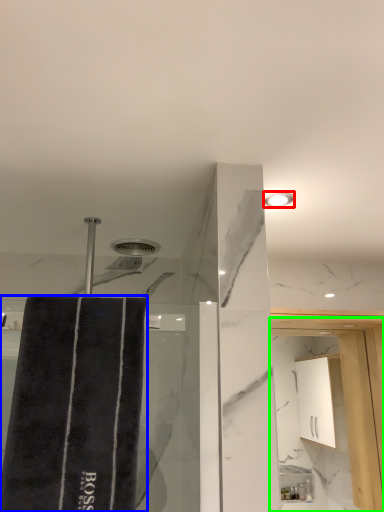
Question: Based on their relative distances, which object is nearer to light fixture (highlighted by a red box)? Choose from bath towel (highlighted by a blue box) and screen door (highlighted by a green box).

Choices:
 (A) bath towel
 (B) screen door

Answer: (A)